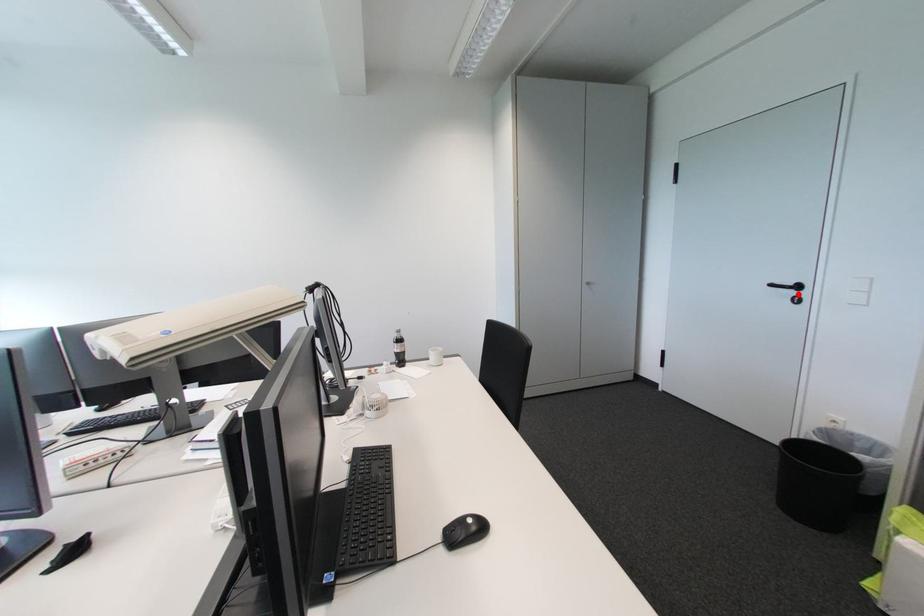
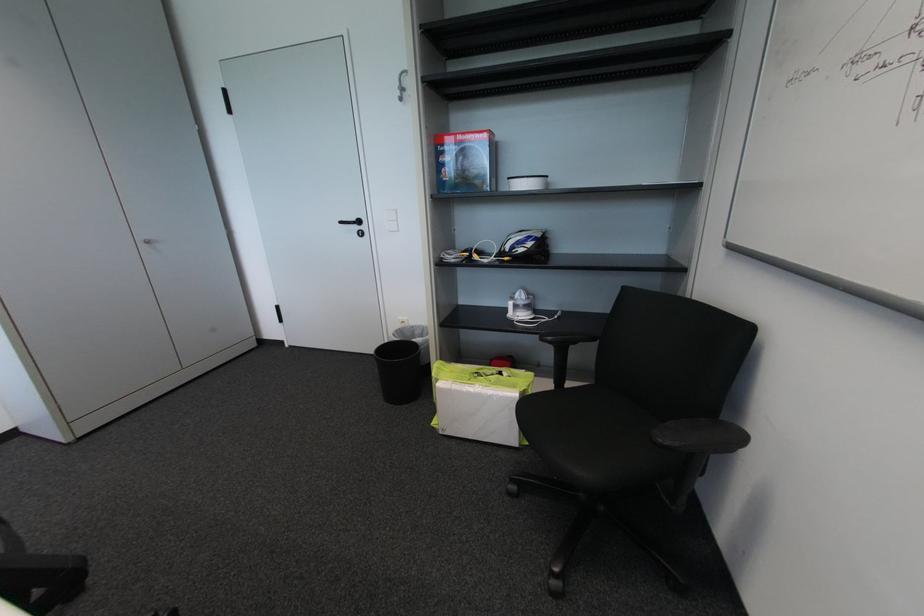
Locate, in the second image, the point that corresponds to the highlighted location in the first image.

(362, 229)